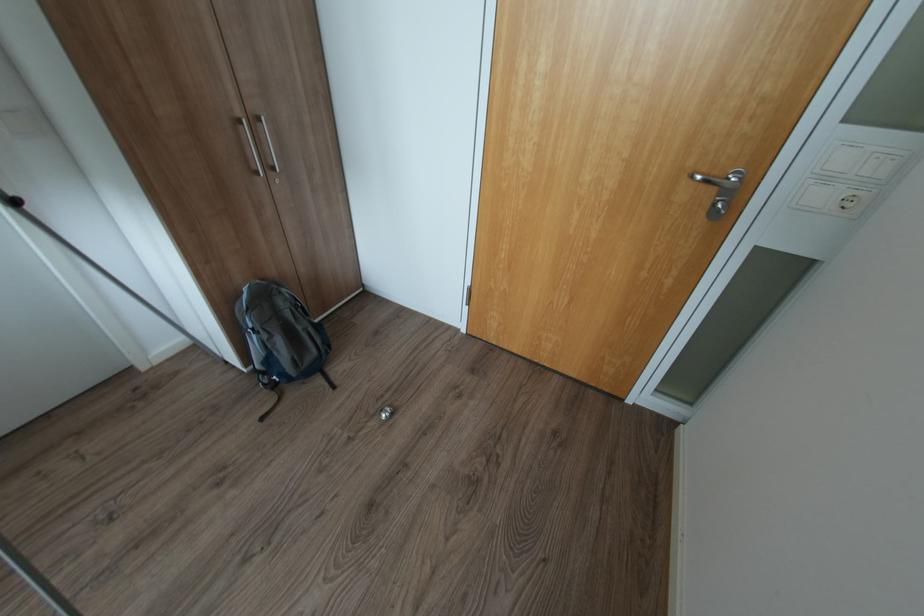
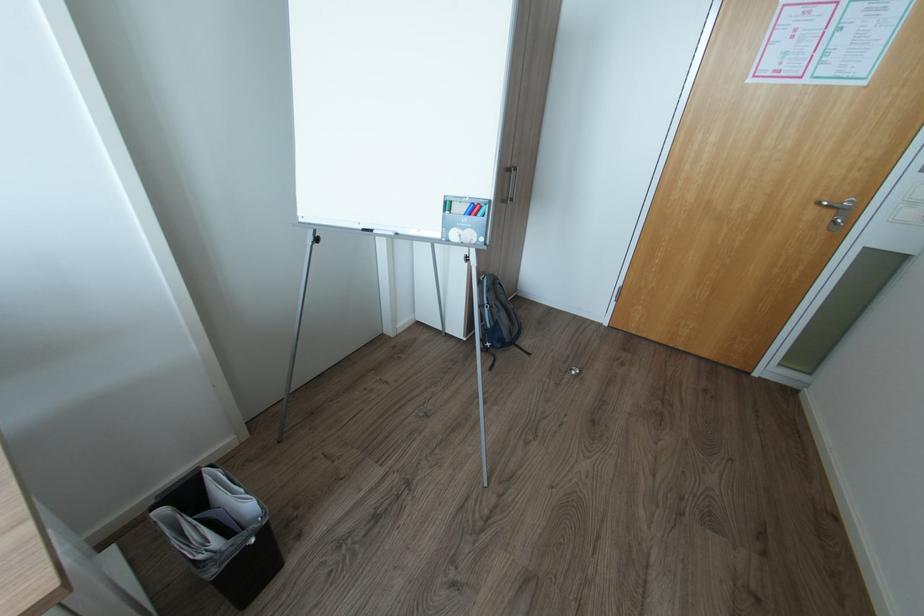
Find the pixel in the second image that matches (703,177) in the first image.

(830, 204)